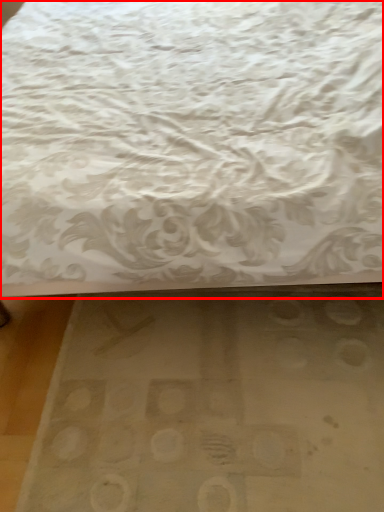
Question: From the image, what is the correct spatial relationship of bed (annotated by the red box) in relation to mat?

Choices:
 (A) left
 (B) right

Answer: (A)